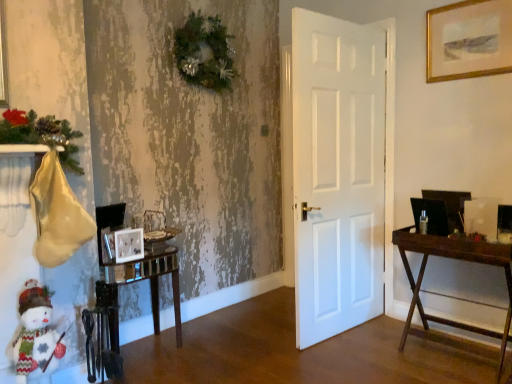
Describe the element at coordinates (452, 296) in the screenshot. I see `wooden desk at right` at that location.

This screenshot has height=384, width=512. Identify the location of matte silver picture frame at lower left, placed as the third picture frame when sorted from right to left. (109, 244).

From a real-world perspective, which is physically below, knitted fabric snowman at lower left or wooden desk at right?

From a 3D spatial view, wooden desk at right is below.

Based on the photo, does knitted fabric snowman at lower left appear on the right side of wooden desk at right?

No.

Is knitted fabric snowman at lower left oriented away from wooden desk at right?

No, knitted fabric snowman at lower left's orientation is not away from wooden desk at right.

Between knitted fabric snowman at lower left and wooden desk at right, which one has larger size?

With larger size is wooden desk at right.

Can you confirm if gold-framed artwork at upper right, acting as the 1th picture frame starting from the top, is bigger than green textured wreath at upper center?

Incorrect, gold-framed artwork at upper right, acting as the 1th picture frame starting from the top, is not larger than green textured wreath at upper center.

Which object is further away from the camera, gold-framed artwork at upper right, the 3th picture frame from the left, or green textured wreath at upper center?

green textured wreath at upper center is behind.

At what (x,y) coordinates should I click in order to perform the action: click on picture frame located on the right of green textured wreath at upper center. Please return your answer as a coordinate pair (x, y). The image size is (512, 384). Looking at the image, I should click on (469, 40).

Which object is thinner, gold-framed artwork at upper right, which is counted as the 3th picture frame, starting from the bottom, or green textured wreath at upper center?

gold-framed artwork at upper right, which is counted as the 3th picture frame, starting from the bottom.

Considering the positions of objects knitted fabric snowman at lower left and matte silver picture frame at lower left, which appears as the 1th picture frame when viewed from the left, in the image provided, who is more to the right, knitted fabric snowman at lower left or matte silver picture frame at lower left, which appears as the 1th picture frame when viewed from the left,?

Positioned to the right is matte silver picture frame at lower left, which appears as the 1th picture frame when viewed from the left.

Measure the distance between knitted fabric snowman at lower left and matte silver picture frame at lower left, which is counted as the 3th picture frame, starting from the top.

A distance of 59.77 centimeters exists between knitted fabric snowman at lower left and matte silver picture frame at lower left, which is counted as the 3th picture frame, starting from the top.

The width and height of the screenshot is (512, 384). I want to click on doll lying on the left of matte silver picture frame at lower left, placed as the third picture frame when sorted from right to left, so click(36, 337).

Is knitted fabric snowman at lower left positioned with its back to matte silver picture frame at lower left, the 1th picture frame from the bottom?

knitted fabric snowman at lower left does not have its back to matte silver picture frame at lower left, the 1th picture frame from the bottom.

From a real-world perspective, is clear glass table at lower left above or below wooden desk at right?

From a real-world perspective, clear glass table at lower left is physically below wooden desk at right.

How far apart are clear glass table at lower left and wooden desk at right?

The distance of clear glass table at lower left from wooden desk at right is 1.57 meters.

Does clear glass table at lower left have a greater width compared to wooden desk at right?

No, clear glass table at lower left is not wider than wooden desk at right.

Looking at this image, from the image's perspective, is clear glass table at lower left beneath wooden desk at right?

Yes, from the image's perspective, clear glass table at lower left is below wooden desk at right.

Can you confirm if knitted fabric snowman at lower left is positioned to the right of clear glass table at lower left?

Incorrect, knitted fabric snowman at lower left is not on the right side of clear glass table at lower left.

Where is `table above the knitted fabric snowman at lower left (from the image's perspective)`? The image size is (512, 384). table above the knitted fabric snowman at lower left (from the image's perspective) is located at coordinates (137, 281).

How far apart are knitted fabric snowman at lower left and clear glass table at lower left?

knitted fabric snowman at lower left and clear glass table at lower left are 59.17 centimeters apart from each other.

Which of these two, matte white picture frame at lower left, the 2th picture frame positioned from the bottom, or matte silver picture frame at lower left, the 1th picture frame from the bottom, stands shorter?

Standing shorter between the two is matte white picture frame at lower left, the 2th picture frame positioned from the bottom.

Consider the image. Relative to matte silver picture frame at lower left, which is counted as the 3th picture frame, starting from the top, is matte white picture frame at lower left, the 2th picture frame positioned from the bottom, in front or behind?

In the image, matte white picture frame at lower left, the 2th picture frame positioned from the bottom, appears in front of matte silver picture frame at lower left, which is counted as the 3th picture frame, starting from the top.

How many degrees apart are the facing directions of matte white picture frame at lower left, marked as the second picture frame in a top-to-bottom arrangement, and matte silver picture frame at lower left, which appears as the 1th picture frame when viewed from the left?

There is a 32.5-degree angle between the facing directions of matte white picture frame at lower left, marked as the second picture frame in a top-to-bottom arrangement, and matte silver picture frame at lower left, which appears as the 1th picture frame when viewed from the left.

From the matte silver picture frame at lower left, the 1th picture frame from the bottom, count 1st picture frame to the right and point to it. Please provide its 2D coordinates.

[(129, 245)]

Based on the photo, is matte white picture frame at lower left, placed as the 2th picture frame when sorted from left to right, next to gold-framed artwork at upper right, the 1th picture frame in the right-to-left sequence, and touching it?

No, matte white picture frame at lower left, placed as the 2th picture frame when sorted from left to right, is not with gold-framed artwork at upper right, the 1th picture frame in the right-to-left sequence.

From a real-world perspective, is matte white picture frame at lower left, the 2th picture frame positioned from the bottom, below gold-framed artwork at upper right, the 1th picture frame in the right-to-left sequence?

Yes.

In terms of height, does matte white picture frame at lower left, the 2th picture frame positioned from the bottom, look taller or shorter compared to gold-framed artwork at upper right, the 1th picture frame in the right-to-left sequence?

In the image, matte white picture frame at lower left, the 2th picture frame positioned from the bottom, appears to be shorter than gold-framed artwork at upper right, the 1th picture frame in the right-to-left sequence.

Considering the points (132, 252) and (437, 9), which point is behind, point (132, 252) or point (437, 9)?

Positioned behind is point (437, 9).

The height and width of the screenshot is (384, 512). Find the location of `doll located above the wooden desk at right (from a real-world perspective)`. doll located above the wooden desk at right (from a real-world perspective) is located at coordinates (36, 337).

You are a GUI agent. You are given a task and a screenshot of the screen. Output one action in this format:
    pyautogui.click(x=<x>, y=<y>)
    Task: Click on the christmas decoration on the left of gold-framed artwork at upper right, acting as the 1th picture frame starting from the top
    
    Given the screenshot: What is the action you would take?
    pyautogui.click(x=205, y=53)

When comparing their distances from gold-framed artwork at upper right, the 1th picture frame in the right-to-left sequence, does matte silver picture frame at lower left, which is counted as the 3th picture frame, starting from the top, or clear glass table at lower left seem further?

matte silver picture frame at lower left, which is counted as the 3th picture frame, starting from the top, is further to gold-framed artwork at upper right, the 1th picture frame in the right-to-left sequence.

In the scene shown: From the image, which object appears to be nearer to gold-framed artwork at upper right, acting as the 1th picture frame starting from the top, knitted fabric snowman at lower left or clear glass table at lower left?

Based on the image, clear glass table at lower left appears to be nearer to gold-framed artwork at upper right, acting as the 1th picture frame starting from the top.

Considering their positions, is matte white picture frame at lower left, marked as the second picture frame in a top-to-bottom arrangement, positioned further to matte silver picture frame at lower left, which appears as the 1th picture frame when viewed from the left, than knitted fabric snowman at lower left?

The object further to matte silver picture frame at lower left, which appears as the 1th picture frame when viewed from the left, is knitted fabric snowman at lower left.

When comparing their distances from matte white picture frame at lower left, marked as the second picture frame in a top-to-bottom arrangement, does clear glass table at lower left or wooden desk at right seem closer?

clear glass table at lower left is closer to matte white picture frame at lower left, marked as the second picture frame in a top-to-bottom arrangement.

From the image, which object appears to be farther from knitted fabric snowman at lower left, matte silver picture frame at lower left, which appears as the 1th picture frame when viewed from the left, or gold-framed artwork at upper right, acting as the 1th picture frame starting from the top?

gold-framed artwork at upper right, acting as the 1th picture frame starting from the top, is further to knitted fabric snowman at lower left.

Based on their spatial positions, is wooden desk at right or knitted fabric snowman at lower left closer to gold-framed artwork at upper right, acting as the 1th picture frame starting from the top?

wooden desk at right.

Considering their positions, is gold-framed artwork at upper right, the 3th picture frame from the left, positioned further to matte silver picture frame at lower left, the 1th picture frame from the bottom, than clear glass table at lower left?

gold-framed artwork at upper right, the 3th picture frame from the left, is further to matte silver picture frame at lower left, the 1th picture frame from the bottom.

Considering their positions, is matte silver picture frame at lower left, the 1th picture frame from the bottom, positioned closer to matte white picture frame at lower left, placed as the 2th picture frame when sorted from left to right, than gold-framed artwork at upper right, which is counted as the 3th picture frame, starting from the bottom?

Among the two, matte silver picture frame at lower left, the 1th picture frame from the bottom, is located nearer to matte white picture frame at lower left, placed as the 2th picture frame when sorted from left to right.

This screenshot has height=384, width=512. I want to click on table between knitted fabric snowman at lower left and gold-framed artwork at upper right, which is counted as the 3th picture frame, starting from the bottom, in the horizontal direction, so click(137, 281).

Find the location of a particular element. The image size is (512, 384). table between knitted fabric snowman at lower left and matte silver picture frame at lower left, which appears as the 1th picture frame when viewed from the left, along the z-axis is located at coordinates (137, 281).

Where is `christmas decoration between matte white picture frame at lower left, placed as the 2th picture frame when sorted from left to right, and gold-framed artwork at upper right, the 1th picture frame in the right-to-left sequence`? The height and width of the screenshot is (384, 512). christmas decoration between matte white picture frame at lower left, placed as the 2th picture frame when sorted from left to right, and gold-framed artwork at upper right, the 1th picture frame in the right-to-left sequence is located at coordinates (205, 53).

The image size is (512, 384). What are the coordinates of `desk between matte white picture frame at lower left, the 2th picture frame positioned from the bottom, and gold-framed artwork at upper right, the 3th picture frame from the left, from left to right` in the screenshot? It's located at (452, 296).